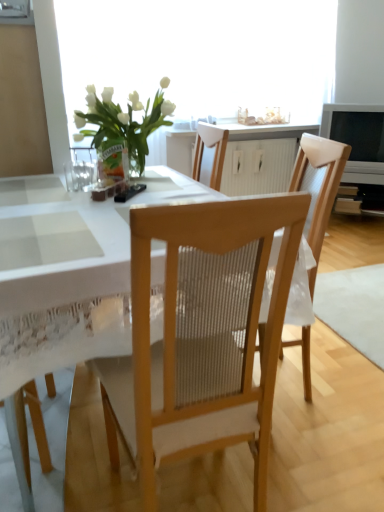
What do you see at coordinates (66, 280) in the screenshot?
I see `white lace tablecloth at center` at bounding box center [66, 280].

Find the location of a particular element. translucent glass window screen at upper center is located at coordinates (202, 55).

Describe the element at coordinates (202, 55) in the screenshot. Image resolution: width=384 pixels, height=512 pixels. I see `translucent glass window screen at upper center` at that location.

Locate an element on the screen. The width and height of the screenshot is (384, 512). wooden chair at center, the 1th chair viewed from the front is located at coordinates (201, 335).

How distant is wooden chair at center, the 2th chair when ordered from back to front, from white wood cabinet at center?

wooden chair at center, the 2th chair when ordered from back to front, is 9.03 feet away from white wood cabinet at center.

Looking at their sizes, would you say wooden chair at center, the 2th chair when ordered from back to front, is wider or thinner than white wood cabinet at center?

wooden chair at center, the 2th chair when ordered from back to front, is wider than white wood cabinet at center.

Who is taller, wooden chair at center, the 2th chair when ordered from back to front, or white wood cabinet at center?

Standing taller between the two is wooden chair at center, the 2th chair when ordered from back to front.

Could you tell me if wooden chair at center, the 1th chair viewed from the front, is turned towards white wood cabinet at center?

No, wooden chair at center, the 1th chair viewed from the front, is not facing towards white wood cabinet at center.

Can we say translucent glass window screen at upper center lies outside white wood cabinet at center?

Indeed, translucent glass window screen at upper center is completely outside white wood cabinet at center.

From the image's perspective, which one is positioned lower, translucent glass window screen at upper center or white wood cabinet at center?

From the image's view, white wood cabinet at center is below.

From a real-world perspective, is translucent glass window screen at upper center positioned above or below white wood cabinet at center?

Clearly, from a real-world perspective, translucent glass window screen at upper center is above white wood cabinet at center.

Considering the relative sizes of translucent glass window screen at upper center and white wood cabinet at center in the image provided, is translucent glass window screen at upper center shorter than white wood cabinet at center?

Incorrect, the height of translucent glass window screen at upper center does not fall short of that of white wood cabinet at center.

Is clear glass vase at center positioned with its back to wooden chair at center, which appears as the first chair when viewed from the back?

clear glass vase at center is not turned away from wooden chair at center, which appears as the first chair when viewed from the back.

Is wooden chair at center, marked as the second chair in a front-to-back arrangement, completely or partially inside clear glass vase at center?

No, wooden chair at center, marked as the second chair in a front-to-back arrangement, is not inside clear glass vase at center.

Where is `vase behind the wooden chair at center, which appears as the first chair when viewed from the back`? vase behind the wooden chair at center, which appears as the first chair when viewed from the back is located at coordinates (112, 163).

Would you say clear glass vase at center is a long distance from wooden chair at center, marked as the second chair in a front-to-back arrangement?

They are positioned close to each other.

Can wooden chair at center, marked as the second chair in a front-to-back arrangement, be found inside translucent glass window screen at upper center?

No, wooden chair at center, marked as the second chair in a front-to-back arrangement, is not inside translucent glass window screen at upper center.

How distant is translucent glass window screen at upper center from wooden chair at center, which appears as the first chair when viewed from the back?

A distance of 5.76 feet exists between translucent glass window screen at upper center and wooden chair at center, which appears as the first chair when viewed from the back.

Could you tell me if translucent glass window screen at upper center is turned towards wooden chair at center, marked as the second chair in a front-to-back arrangement?

Yes, translucent glass window screen at upper center is aimed at wooden chair at center, marked as the second chair in a front-to-back arrangement.

Looking at this image, from a real-world perspective, does translucent glass window screen at upper center stand above wooden chair at center, which appears as the first chair when viewed from the back?

Yes, from a real-world perspective, translucent glass window screen at upper center is on top of wooden chair at center, which appears as the first chair when viewed from the back.

Between clear glass vase at center and wooden chair at center, the 1th chair viewed from the front, which one has smaller width?

clear glass vase at center.

Locate an element on the screen. The image size is (384, 512). the 2nd chair in front of the clear glass vase at center is located at coordinates (201, 335).

From a real-world perspective, is clear glass vase at center physically located above or below wooden chair at center, the 2th chair when ordered from back to front?

clear glass vase at center is above wooden chair at center, the 2th chair when ordered from back to front.

Choose the correct answer: Is clear glass vase at center inside wooden chair at center, the 2th chair when ordered from back to front, or outside it?

The correct answer is: outside.

Considering the relative sizes of white wood cabinet at center and wooden chair at center, the 2th chair when ordered from back to front, in the image provided, is white wood cabinet at center taller than wooden chair at center, the 2th chair when ordered from back to front,?

In fact, white wood cabinet at center may be shorter than wooden chair at center, the 2th chair when ordered from back to front.

How distant is white wood cabinet at center from wooden chair at center, the 1th chair viewed from the front?

A distance of 2.75 meters exists between white wood cabinet at center and wooden chair at center, the 1th chair viewed from the front.

Considering their positions, is white wood cabinet at center located in front of or behind wooden chair at center, the 2th chair when ordered from back to front?

white wood cabinet at center is positioned farther from the viewer than wooden chair at center, the 2th chair when ordered from back to front.

Is white wood cabinet at center spatially inside wooden chair at center, the 1th chair viewed from the front, or outside of it?

white wood cabinet at center lies outside wooden chair at center, the 1th chair viewed from the front.

Considering the points (241, 376) and (258, 108), which point is in front, point (241, 376) or point (258, 108)?

The point (241, 376) is more forward.

In order to click on the 2nd chair counting from the left of the translucent glass window screen at upper center in this screenshot , I will do `click(201, 335)`.

Is wooden chair at center, the 2th chair when ordered from back to front, positioned behind translucent glass window screen at upper center?

No, wooden chair at center, the 2th chair when ordered from back to front, is closer to the camera.

I want to click on cabinetry that appears above the wooden chair at center, the 1th chair viewed from the front (from the image's perspective), so click(x=238, y=156).

Locate an element on the screen. The width and height of the screenshot is (384, 512). window screen on the left of white wood cabinet at center is located at coordinates (202, 55).

Based on their spatial positions, is clear glass vase at center or white wood cabinet at center further from wooden chair at center, marked as the second chair in a front-to-back arrangement?

Among the two, white wood cabinet at center is located further to wooden chair at center, marked as the second chair in a front-to-back arrangement.

From the image, which object appears to be farther from wooden chair at center, which appears as the first chair when viewed from the back, clear glass vase at center or wooden chair at center, the 2th chair when ordered from back to front?

Based on the image, clear glass vase at center appears to be further to wooden chair at center, which appears as the first chair when viewed from the back.

Considering their positions, is clear glass vase at center positioned closer to wooden chair at center, which appears as the first chair when viewed from the back, than translucent glass window screen at upper center?

clear glass vase at center.

Consider the image. From the image, which object appears to be farther from wooden chair at center, marked as the second chair in a front-to-back arrangement, white wood cabinet at center or white lace tablecloth at center?

Based on the image, white wood cabinet at center appears to be further to wooden chair at center, marked as the second chair in a front-to-back arrangement.

Which object lies nearer to the anchor point wooden chair at center, the 1th chair viewed from the front, wooden chair at center, marked as the second chair in a front-to-back arrangement, or white wood cabinet at center?

Among the two, wooden chair at center, marked as the second chair in a front-to-back arrangement, is located nearer to wooden chair at center, the 1th chair viewed from the front.

Looking at the image, which one is located further to white wood cabinet at center, wooden chair at center, marked as the second chair in a front-to-back arrangement, or clear glass vase at center?

clear glass vase at center is positioned further to the anchor white wood cabinet at center.

Looking at the image, which one is located closer to white wood cabinet at center, wooden chair at center, the 2th chair when ordered from back to front, or white lace tablecloth at center?

white lace tablecloth at center is positioned closer to the anchor white wood cabinet at center.

Based on the photo, estimate the real-world distances between objects in this image. Which object is closer to wooden chair at center, the 1th chair viewed from the front, wooden chair at center, marked as the second chair in a front-to-back arrangement, or translucent glass window screen at upper center?

wooden chair at center, marked as the second chair in a front-to-back arrangement.

Where is `table between wooden chair at center, the 2th chair when ordered from back to front, and translucent glass window screen at upper center in the front-back direction`? The height and width of the screenshot is (512, 384). table between wooden chair at center, the 2th chair when ordered from back to front, and translucent glass window screen at upper center in the front-back direction is located at coordinates (66, 280).

This screenshot has height=512, width=384. What are the coordinates of `window screen between white lace tablecloth at center and white wood cabinet at center from front to back` in the screenshot? It's located at (202, 55).

Locate an element on the screen. The height and width of the screenshot is (512, 384). window screen located between clear glass vase at center and white wood cabinet at center in the depth direction is located at coordinates (202, 55).

The height and width of the screenshot is (512, 384). What are the coordinates of `window screen located between wooden chair at center, the 1th chair viewed from the front, and white wood cabinet at center in the depth direction` in the screenshot? It's located at (202, 55).